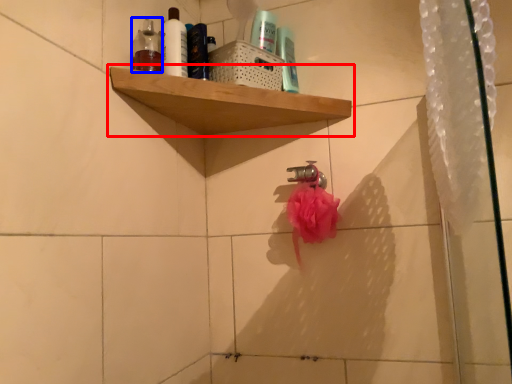
Question: Which object appears closest to the camera in this image, shelf (highlighted by a red box) or toiletry (highlighted by a blue box)?

Choices:
 (A) shelf
 (B) toiletry

Answer: (A)